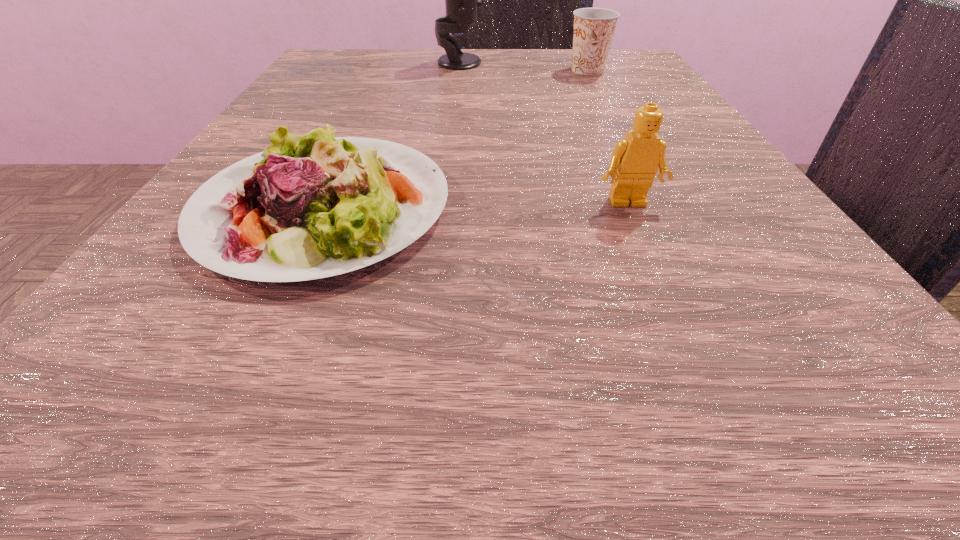
I want to click on vacant space at the near right corner, so click(694, 345).

This screenshot has width=960, height=540. What are the coordinates of `vacant point located between the shortest object and the Dixie cup` in the screenshot? It's located at (456, 139).

Identify the location of vacant area that lies between the salad plate and the tallest object. (392, 135).

Image resolution: width=960 pixels, height=540 pixels. What are the coordinates of `free space between the Dixie cup and the microphone` in the screenshot? It's located at (523, 66).

What are the coordinates of `empty space between the Lego and the third tallest object` in the screenshot? It's located at (608, 137).

Image resolution: width=960 pixels, height=540 pixels. I want to click on free point between the Dixie cup and the shortest object, so pyautogui.click(x=456, y=139).

Find the location of `vacant space that is in between the Lego and the microphone`. vacant space that is in between the Lego and the microphone is located at coordinates (543, 133).

I want to click on unoccupied position between the third tallest object and the Lego, so click(608, 137).

Find the location of a particular element. free spot between the Lego and the microphone is located at coordinates (543, 133).

Find the location of a particular element. The height and width of the screenshot is (540, 960). free spot between the tallest object and the Lego is located at coordinates (543, 133).